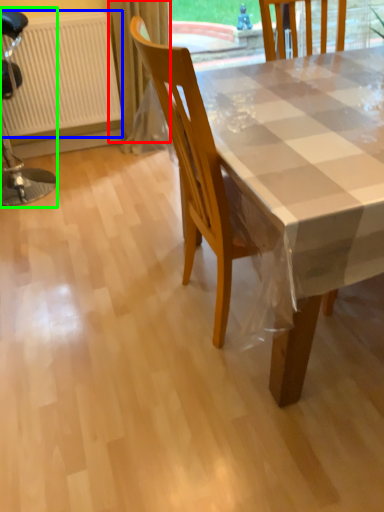
Question: Which object is positioned farthest from curtain (highlighted by a red box)? Select from radiator (highlighted by a blue box) and chair (highlighted by a green box).

Choices:
 (A) radiator
 (B) chair

Answer: (B)